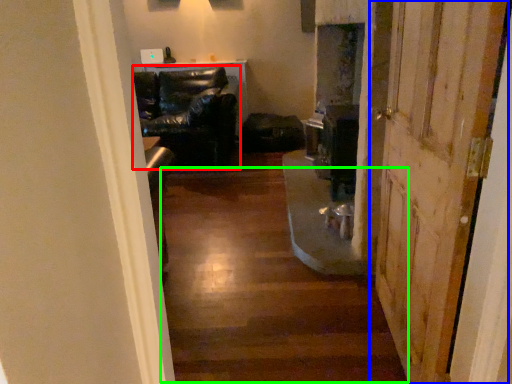
Question: Which object is the farthest from chair (highlighted by a red box)? Choose among these: door (highlighted by a blue box) or stairwell (highlighted by a green box).

Choices:
 (A) door
 (B) stairwell

Answer: (A)